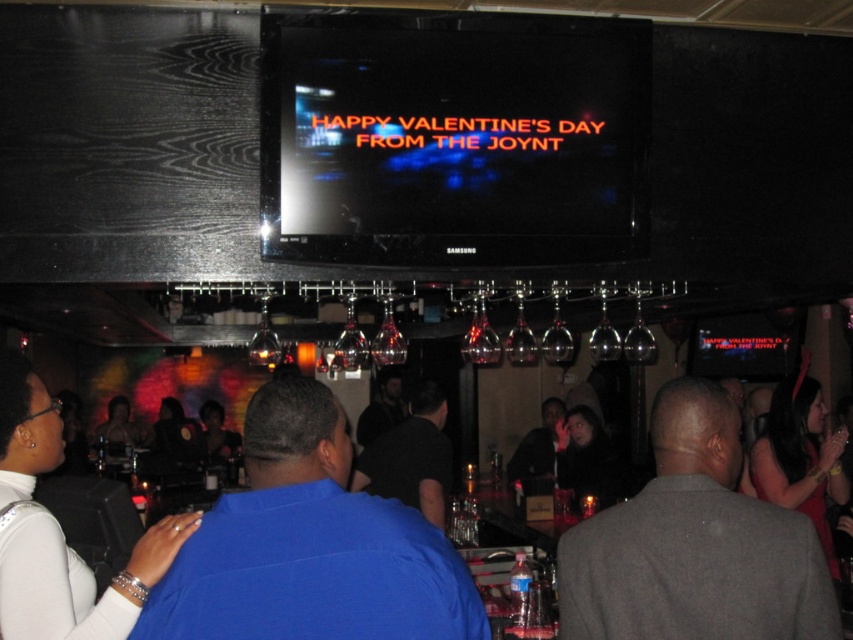
You are a photographer standing in front of the bar area. You want to take a photo of both the gray fabric suit at center and the dark gray shirt at center. Which one will appear larger in the photo?

The gray fabric suit at center will appear larger in the photo because it is closer to the viewer than the dark gray shirt at center.

You are a photographer positioned at the entrance of the bar. You want to take a photo of the blue matte shirt at center so that it appears centered in your frame. Given the coordinates provided, where should you aim your camera? Please specify the coordinates in the format of a point within the image plane.

The blue matte shirt at center is located at coordinates point (310, 545), so you should aim your camera at that point to center it in your frame.

You are a photographer positioned at the entrance of The Joynt bar. You want to capture a photo of the blue matte shirt at center while ensuring the large flat screen TV above the bar is also visible in the frame. Based on their positions, can you include both in your shot?

The blue matte shirt at center is located at point (310, 545). Since the TV is mounted above the bar area and the shirt is at the center, it is likely possible to frame both in the shot by adjusting the camera angle to include the lower center area where the shirt is and the upper area where the TV is positioned.